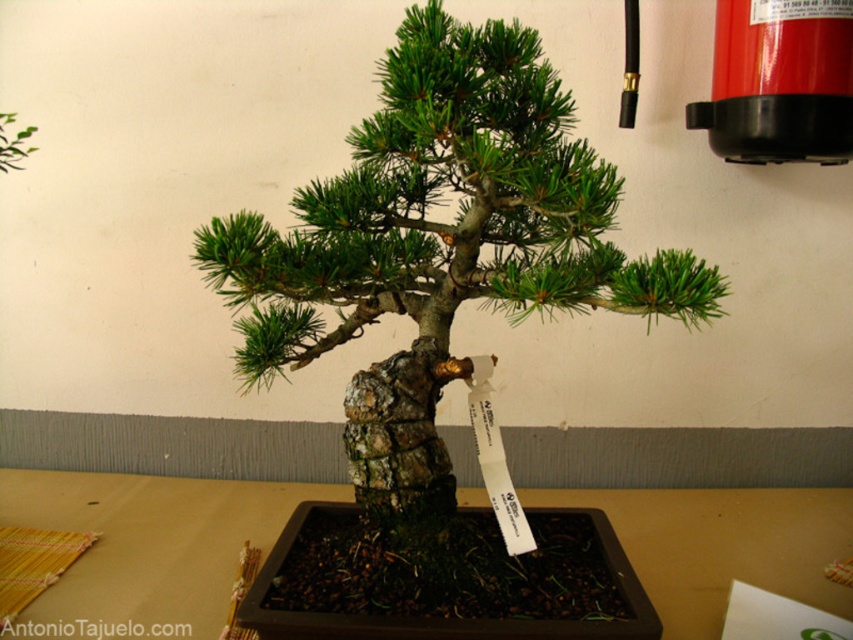
You are standing in front of a brown wooden table at center and see a green textured bonsai at center. Which object is positioned to the right side?

The green textured bonsai at center is positioned to the right of the brown wooden table at center.

You are standing in front of the bonsai tree and want to place a small decoration on one of the two points mentioned. Which point is closer to you, point (469, 164) or point (776, 545)?

Point (469, 164) is closer to the viewer than point (776, 545), so you should place the decoration there if you want it closer.

You are standing in front of a bonsai tree displayed on a table. There is a point at coordinates (439,243). What does this point indicate?

The point at coordinates (439,243) marks the green textured bonsai at center.